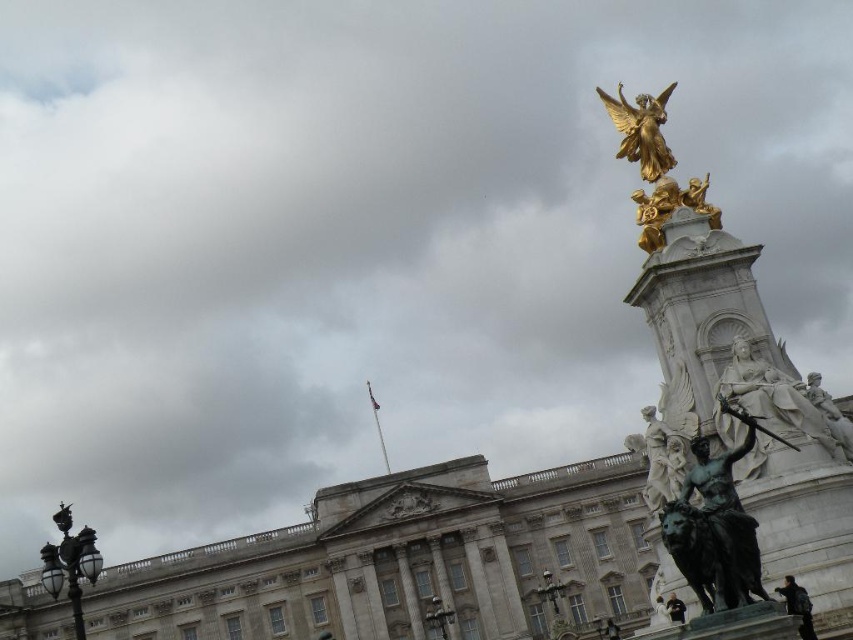
Question: Which point is closer to the camera?

Choices:
 (A) white marble statue at right
 (B) white marble statue at center-right
 (C) gold polished statue at upper right

Answer: (A)

Question: Is bronze statue at right bigger than gold polished statue at upper right?

Choices:
 (A) yes
 (B) no

Answer: (A)

Question: Among these points, which one is farthest from the camera?

Choices:
 (A) (612, 100)
 (B) (822, 442)
 (C) (701, 556)
 (D) (677, 492)

Answer: (A)

Question: Does white marble statue at right come in front of gold polished statue at upper right?

Choices:
 (A) yes
 (B) no

Answer: (A)

Question: Estimate the real-world distances between objects in this image. Which object is farther from the white marble statue at right?

Choices:
 (A) white marble statue at center-right
 (B) bronze statue at right
 (C) gold polished statue at upper right

Answer: (C)

Question: Does white marble statue at center-right have a smaller size compared to gold polished statue at upper right?

Choices:
 (A) no
 (B) yes

Answer: (B)